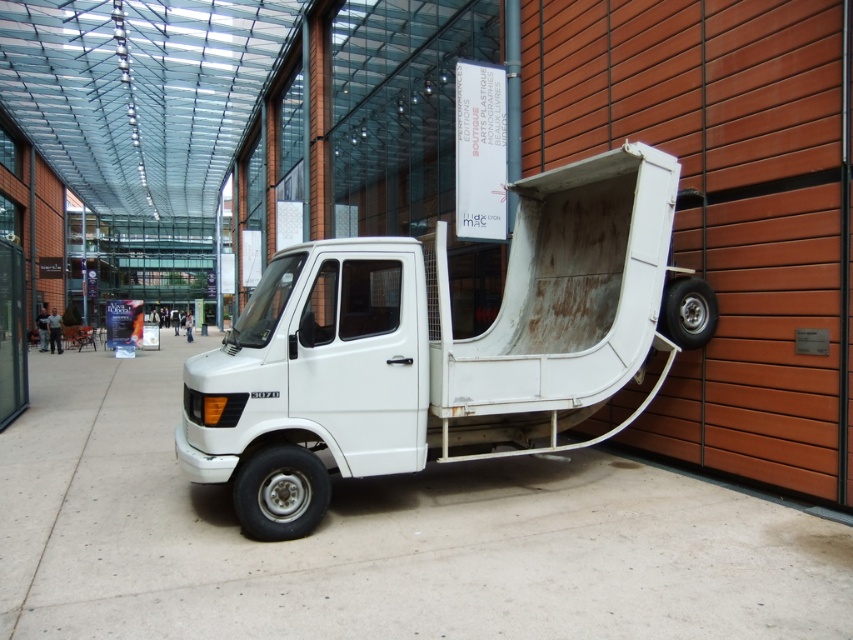
Question: Is gray concrete pavement at center positioned before white matte truck at center?

Choices:
 (A) no
 (B) yes

Answer: (B)

Question: Is gray concrete pavement at center above white matte truck at center?

Choices:
 (A) no
 (B) yes

Answer: (A)

Question: Is gray concrete pavement at center below white matte truck at center?

Choices:
 (A) yes
 (B) no

Answer: (A)

Question: Which point appears farthest from the camera in this image?

Choices:
 (A) (422, 285)
 (B) (466, 518)

Answer: (B)

Question: Which of the following is the closest to the observer?

Choices:
 (A) (837, 544)
 (B) (322, 465)

Answer: (A)